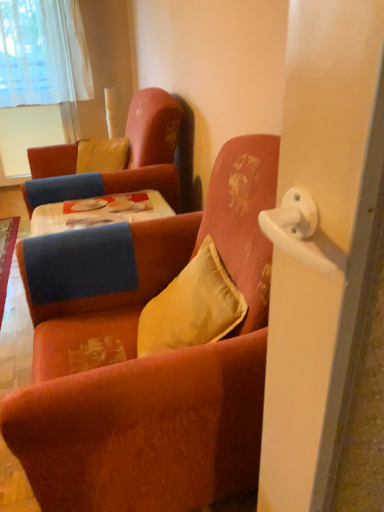
Question: Does yellow velvet pillow at upper left, the 2th pillow positioned from the front, lie behind velvet orange armchair at center, the second chair positioned from the back?

Choices:
 (A) no
 (B) yes

Answer: (B)

Question: From a real-world perspective, is yellow velvet pillow at upper left, the 2th pillow positioned from the front, positioned under velvet orange armchair at center, which is the first chair from front to back, based on gravity?

Choices:
 (A) no
 (B) yes

Answer: (A)

Question: Can you confirm if yellow velvet pillow at upper left, the 2th pillow positioned from the front, is wider than velvet orange armchair at center, which is the first chair from front to back?

Choices:
 (A) no
 (B) yes

Answer: (A)

Question: Can we say yellow velvet pillow at upper left, the second pillow ordered from the bottom, lies outside velvet orange armchair at center, the second chair positioned from the back?

Choices:
 (A) yes
 (B) no

Answer: (A)

Question: Considering the relative sizes of yellow velvet pillow at upper left, which is the 1th pillow from left to right, and velvet orange armchair at center, which is the first chair from front to back, in the image provided, is yellow velvet pillow at upper left, which is the 1th pillow from left to right, taller than velvet orange armchair at center, which is the first chair from front to back,?

Choices:
 (A) no
 (B) yes

Answer: (A)

Question: Is velvet orange armchair at upper left, positioned as the first chair in back-to-front order, bigger or smaller than white sheer curtain at upper left?

Choices:
 (A) small
 (B) big

Answer: (B)

Question: Considering the positions of velvet orange armchair at upper left, positioned as the first chair in back-to-front order, and white sheer curtain at upper left in the image, is velvet orange armchair at upper left, positioned as the first chair in back-to-front order, taller or shorter than white sheer curtain at upper left?

Choices:
 (A) tall
 (B) short

Answer: (B)

Question: From a real-world perspective, relative to white sheer curtain at upper left, is velvet orange armchair at upper left, positioned as the first chair in back-to-front order, vertically above or below?

Choices:
 (A) below
 (B) above

Answer: (A)

Question: Considering the positions of point (170, 120) and point (61, 118), is point (170, 120) closer or farther from the camera than point (61, 118)?

Choices:
 (A) closer
 (B) farther

Answer: (A)

Question: Is velvet orange armchair at center, which is the first chair from front to back, wider or thinner than yellow velvet pillow at upper left, the 1th pillow from the back?

Choices:
 (A) thin
 (B) wide

Answer: (B)

Question: From a real-world perspective, is velvet orange armchair at center, the second chair positioned from the back, positioned above or below yellow velvet pillow at upper left, the 1th pillow from the back?

Choices:
 (A) above
 (B) below

Answer: (B)

Question: Is point (241, 151) closer or farther from the camera than point (114, 169)?

Choices:
 (A) closer
 (B) farther

Answer: (A)

Question: Is velvet orange armchair at center, the second chair positioned from the back, inside the boundaries of yellow velvet pillow at upper left, the first pillow in the top-to-bottom sequence, or outside?

Choices:
 (A) inside
 (B) outside

Answer: (B)

Question: Is point (82, 160) closer or farther from the camera than point (72, 144)?

Choices:
 (A) closer
 (B) farther

Answer: (A)

Question: Is yellow velvet pillow at upper left, which is the 1th pillow from left to right, taller or shorter than velvet orange armchair at upper left, positioned as the first chair in back-to-front order?

Choices:
 (A) tall
 (B) short

Answer: (B)